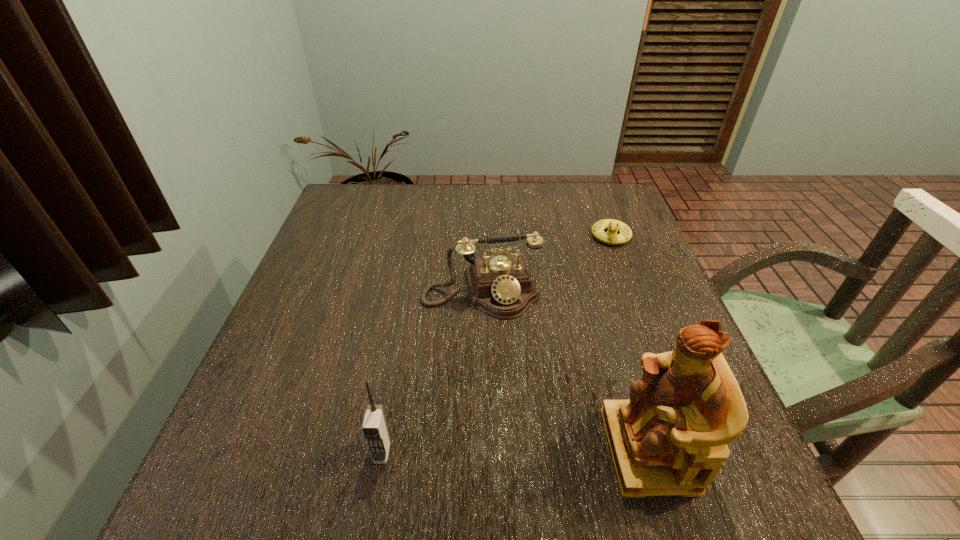
Identify the location of empty space that is in between the telephone and the leftmost object. (432, 372).

At what (x,y) coordinates should I click in order to perform the action: click on empty space between the figurine and the telephone. Please return your answer as a coordinate pair (x, y). The height and width of the screenshot is (540, 960). Looking at the image, I should click on (565, 370).

The height and width of the screenshot is (540, 960). I want to click on empty space that is in between the tallest object and the third object from right to left, so click(x=565, y=370).

You are a GUI agent. You are given a task and a screenshot of the screen. Output one action in this format:
    pyautogui.click(x=<x>, y=<y>)
    Task: Click on the empty space between the cellular telephone and the tallest object
    The height and width of the screenshot is (540, 960).
    Given the screenshot: What is the action you would take?
    pyautogui.click(x=516, y=451)

What are the coordinates of `free spot between the cellular telephone and the figurine` in the screenshot? It's located at (516, 451).

At what (x,y) coordinates should I click in order to perform the action: click on empty space between the tallest object and the cellular telephone. Please return your answer as a coordinate pair (x, y). The height and width of the screenshot is (540, 960). Looking at the image, I should click on (516, 451).

Identify the location of unoccupied area between the telephone and the cellular telephone. This screenshot has width=960, height=540. (432, 372).

I want to click on free space between the cellular telephone and the farthest object, so click(496, 344).

Locate an element on the screen. The width and height of the screenshot is (960, 540). free space between the cellular telephone and the telephone is located at coordinates (432, 372).

This screenshot has width=960, height=540. What are the coordinates of `object that is the third closest one to the figurine` in the screenshot? It's located at (611, 237).